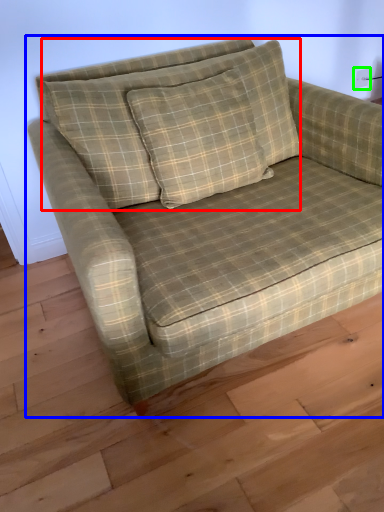
Question: Which object is positioned farthest from pillow (highlighted by a red box)? Select from studio couch (highlighted by a blue box) and electric outlet (highlighted by a green box).

Choices:
 (A) studio couch
 (B) electric outlet

Answer: (B)